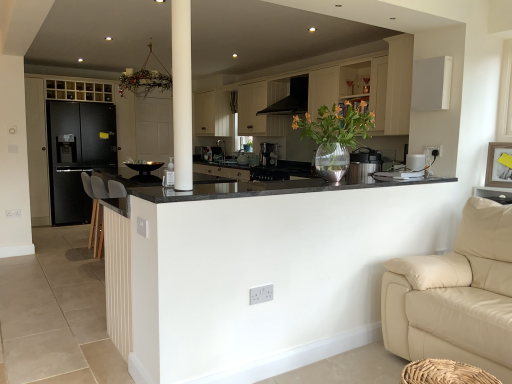
Question: From the image's perspective, is black plastic thermos at center, the third appliance viewed from the left, on black granite countertop at center?

Choices:
 (A) no
 (B) yes

Answer: (B)

Question: Can you confirm if black plastic thermos at center, which is the 3th appliance from back to front, is shorter than black granite countertop at center?

Choices:
 (A) yes
 (B) no

Answer: (B)

Question: Does black plastic thermos at center, which ranks as the second appliance in front-to-back order, appear on the right side of black granite countertop at center?

Choices:
 (A) no
 (B) yes

Answer: (B)

Question: Could you tell me if black plastic thermos at center, which is the 3th appliance from back to front, is facing black granite countertop at center?

Choices:
 (A) yes
 (B) no

Answer: (B)

Question: Is black granite countertop at center a part of black plastic thermos at center, the third appliance viewed from the left?

Choices:
 (A) yes
 (B) no

Answer: (B)

Question: Considering the relative sizes of black plastic thermos at center, which is the 3th appliance from back to front, and black granite countertop at center in the image provided, is black plastic thermos at center, which is the 3th appliance from back to front, wider than black granite countertop at center?

Choices:
 (A) no
 (B) yes

Answer: (A)

Question: From a real-world perspective, is clear glass vase at center located higher than black matte refrigerator at left, which ranks as the first cabinetry in left-to-right order?

Choices:
 (A) yes
 (B) no

Answer: (A)

Question: From the image's perspective, is clear glass vase at center on black matte refrigerator at left, which is counted as the 2th cabinetry, starting from the right?

Choices:
 (A) yes
 (B) no

Answer: (B)

Question: Is clear glass vase at center positioned far away from black matte refrigerator at left, which ranks as the first cabinetry in left-to-right order?

Choices:
 (A) yes
 (B) no

Answer: (A)

Question: Does clear glass vase at center have a greater width compared to black matte refrigerator at left, which is counted as the 2th cabinetry, starting from the right?

Choices:
 (A) no
 (B) yes

Answer: (A)

Question: Is clear glass vase at center in contact with black matte refrigerator at left, which is counted as the 2th cabinetry, starting from the right?

Choices:
 (A) no
 (B) yes

Answer: (A)

Question: From a real-world perspective, is clear glass vase at center physically below black matte refrigerator at left, which ranks as the first cabinetry in left-to-right order?

Choices:
 (A) no
 (B) yes

Answer: (A)

Question: Can you confirm if satin black coffee machine at center is shorter than white plastic toaster at upper right, placed as the fourth appliance when sorted from left to right?

Choices:
 (A) no
 (B) yes

Answer: (A)